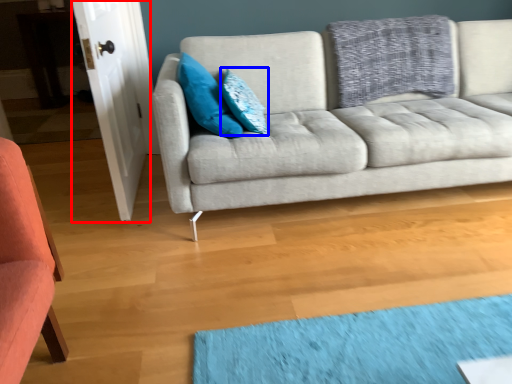
Question: Which of the following is the farthest to the observer, door (highlighted by a red box) or pillow (highlighted by a blue box)?

Choices:
 (A) door
 (B) pillow

Answer: (B)